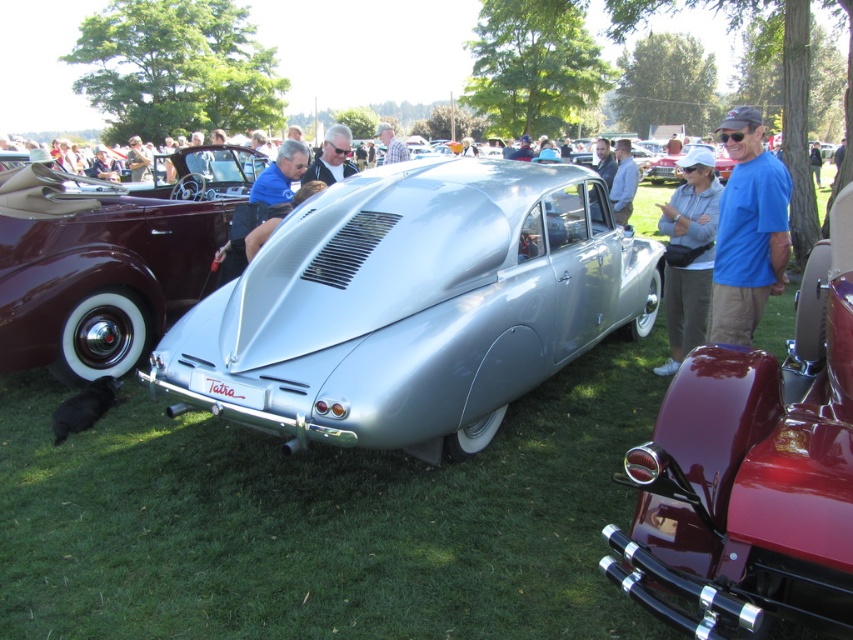
Is blue cotton shirt at right smaller than light gray fabric jacket at center?

Incorrect, blue cotton shirt at right is not smaller in size than light gray fabric jacket at center.

Which is above, blue cotton shirt at right or light gray fabric jacket at center?

blue cotton shirt at right

Who is more distant from viewer, [744,308] or [694,301]?

The point [694,301] is behind.

You are a GUI agent. You are given a task and a screenshot of the screen. Output one action in this format:
    pyautogui.click(x=<x>, y=<y>)
    Task: Click on the blue cotton shirt at right
    
    Given the screenshot: What is the action you would take?
    pyautogui.click(x=747, y=230)

Which is more to the left, blue cotton shirt at right or matte blue shirt at center?

Positioned to the left is matte blue shirt at center.

Which of these two, blue cotton shirt at right or matte blue shirt at center, stands taller?

With more height is blue cotton shirt at right.

Identify the location of blue cotton shirt at right. (747, 230).

You are a GUI agent. You are given a task and a screenshot of the screen. Output one action in this format:
    pyautogui.click(x=<x>, y=<y>)
    Task: Click on the blue cotton shirt at right
    This screenshot has width=853, height=640.
    Given the screenshot: What is the action you would take?
    pyautogui.click(x=747, y=230)

Is sleek silver car at center above blue cotton shirt at right?

No, sleek silver car at center is not above blue cotton shirt at right.

Based on the photo, is sleek silver car at center to the left of blue cotton shirt at right from the viewer's perspective?

Indeed, sleek silver car at center is positioned on the left side of blue cotton shirt at right.

At what (x,y) coordinates should I click in order to perform the action: click on sleek silver car at center. Please return your answer as a coordinate pair (x, y). Looking at the image, I should click on (413, 307).